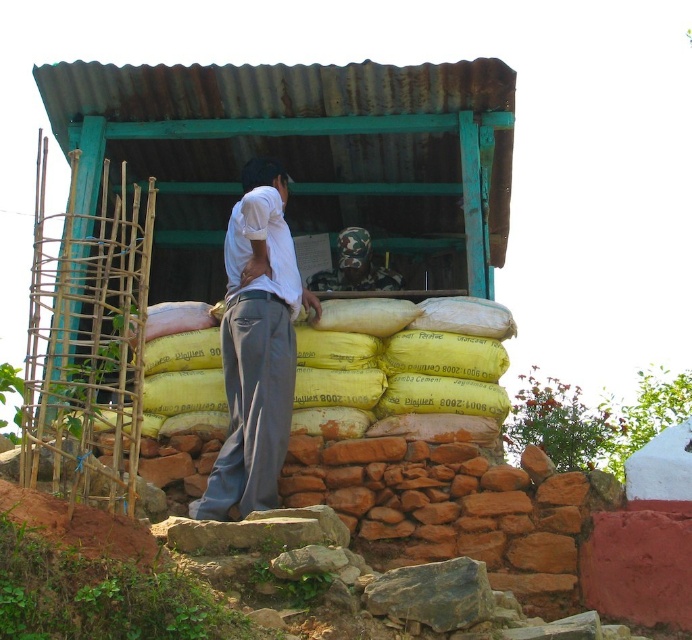
Question: Which is farther from the gray cotton pants at center?

Choices:
 (A) white cotton shirt at center
 (B) camouflage fabric at center

Answer: (B)

Question: Can you confirm if white cotton shirt at center is smaller than gray cotton pants at center?

Choices:
 (A) no
 (B) yes

Answer: (A)

Question: Which of the following is the farthest from the observer?

Choices:
 (A) (343, 282)
 (B) (251, 502)
 (C) (266, 460)

Answer: (A)

Question: Is white cotton shirt at center wider than gray cotton pants at center?

Choices:
 (A) yes
 (B) no

Answer: (A)

Question: Does white cotton shirt at center have a greater width compared to camouflage fabric at center?

Choices:
 (A) no
 (B) yes

Answer: (A)

Question: Which point appears farthest from the camera in this image?

Choices:
 (A) (358, 280)
 (B) (282, 250)

Answer: (A)